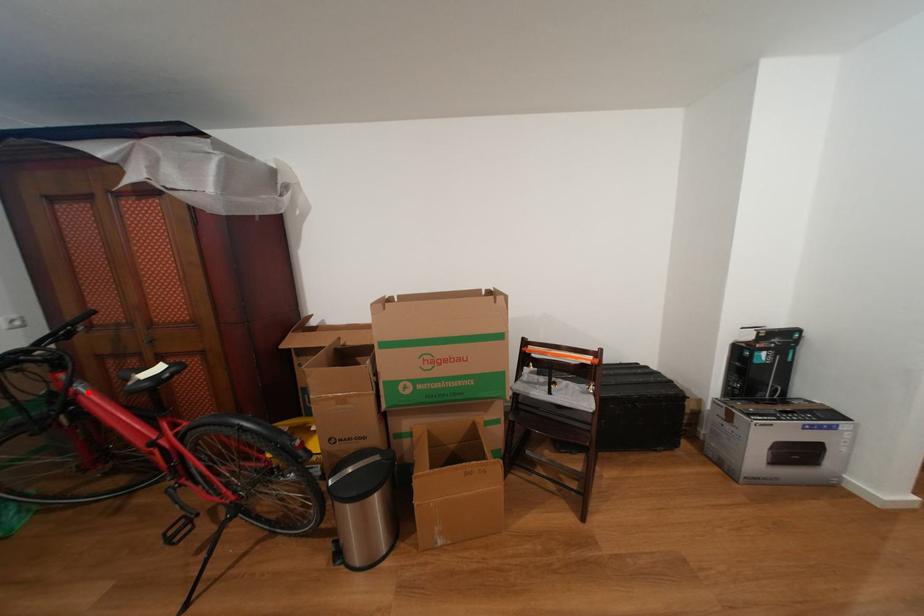
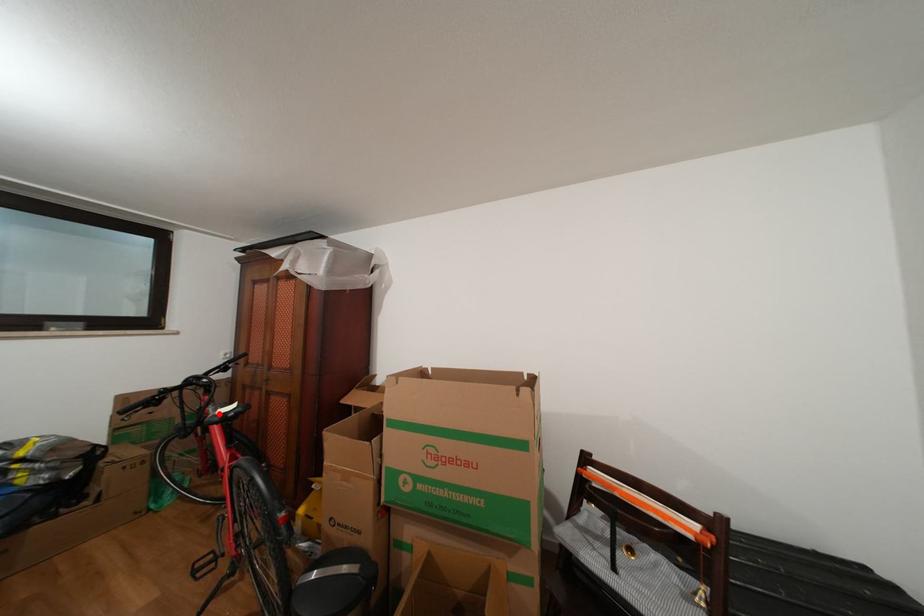
I am providing you with two images of the same scene from different viewpoints. A red point is marked on the first image and another point is marked on the second image. Is the marked point in image1 the same physical position as the marked point in image2?

Yes